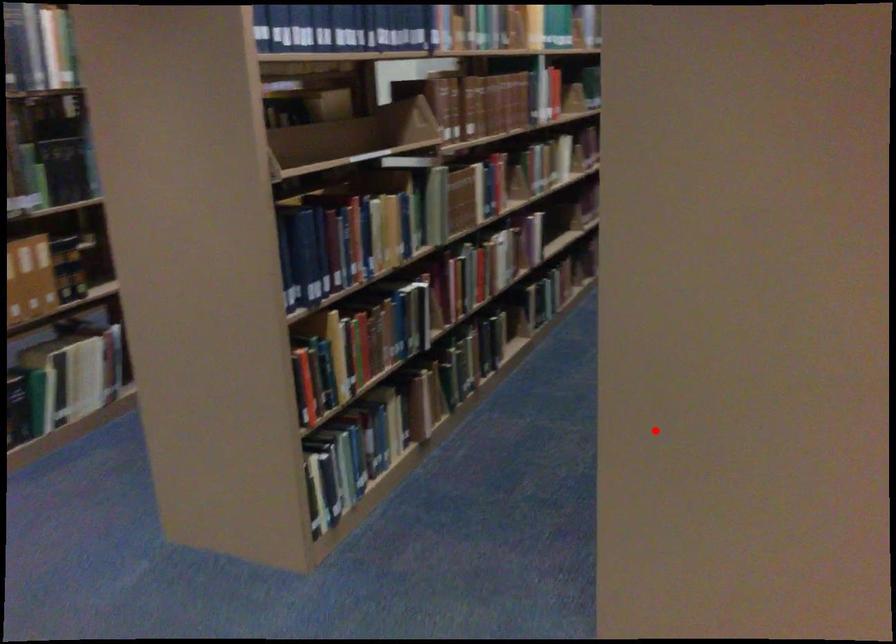
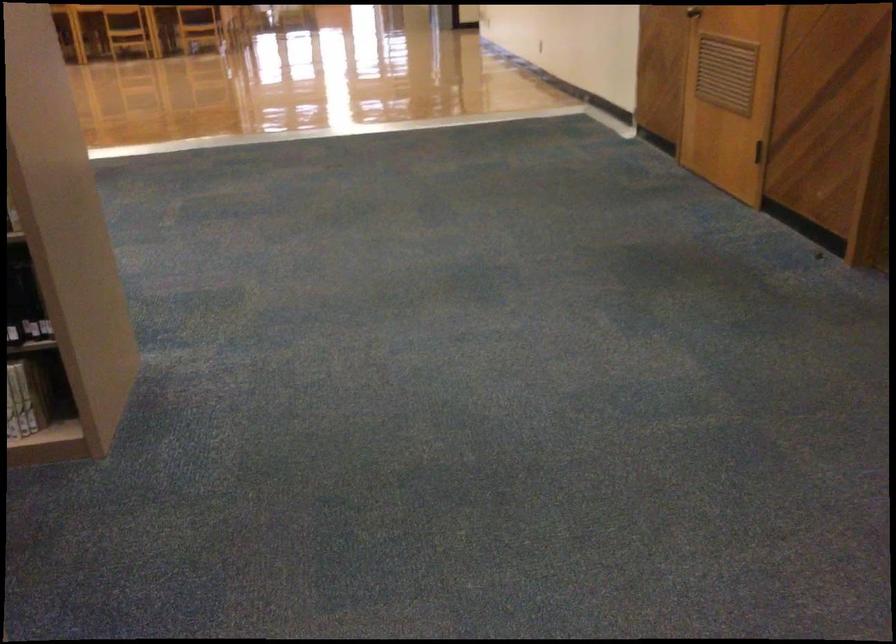
Question: I am providing you with two images of the same scene from different viewpoints. Image1 has a red point marked. In image2, the corresponding 3D location appears at what relative position? Reply with the corresponding letter.

Choices:
 (A) Closer
 (B) Farther

Answer: (B)